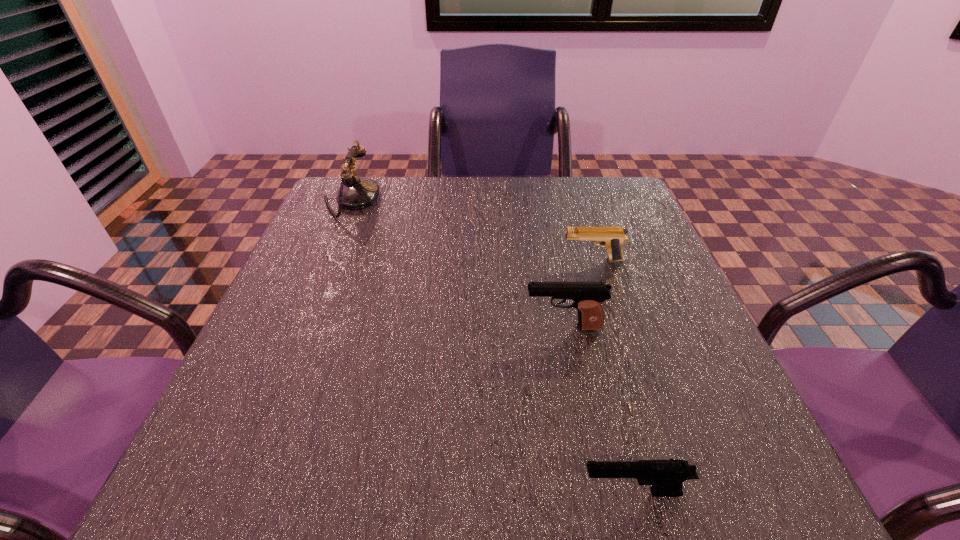
This screenshot has height=540, width=960. I want to click on object present at the near right corner, so click(666, 476).

In order to click on blank space at the far edge of the desktop in this screenshot , I will do `click(433, 204)`.

In the image, there is a desktop. At what (x,y) coordinates should I click in order to perform the action: click on free space at the near edge. Please return your answer as a coordinate pair (x, y). The height and width of the screenshot is (540, 960). Looking at the image, I should click on (636, 458).

Identify the location of free point at the left edge. The image size is (960, 540). (338, 229).

In the image, there is a desktop. Identify the location of vacant space at the right edge. (661, 255).

This screenshot has width=960, height=540. In the image, there is a desktop. Find the location of `vacant area at the far left corner`. vacant area at the far left corner is located at coordinates (343, 212).

At what (x,y) coordinates should I click in order to perform the action: click on vacant region at the far right corner of the desktop. Please return your answer as a coordinate pair (x, y). The image size is (960, 540). Looking at the image, I should click on (608, 191).

Identify the location of vacant space that's between the leftmost object and the nearest pistol. This screenshot has height=540, width=960. (492, 346).

Identify the location of free spot between the third nearest object and the nearest object. The image size is (960, 540). (612, 376).

I want to click on vacant space in between the leftmost object and the farthest pistol, so click(x=471, y=231).